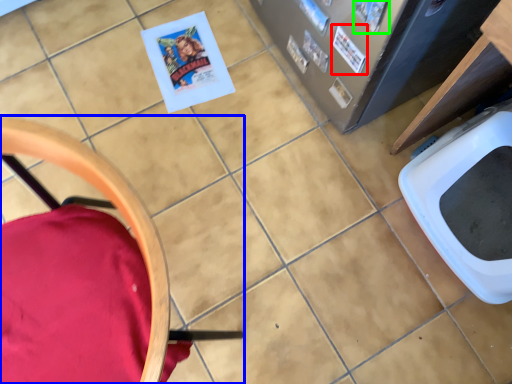
Question: Which is nearer to the comic book (highlighted by a red box)? chair (highlighted by a blue box) or comic book (highlighted by a green box).

Choices:
 (A) chair
 (B) comic book

Answer: (B)